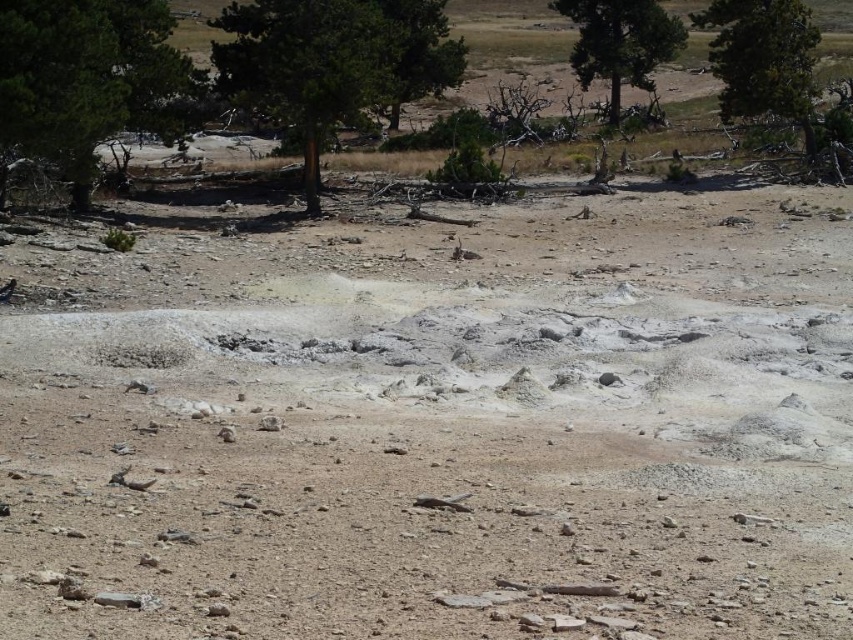
Question: Among these points, which one is nearest to the camera?

Choices:
 (A) (538, 333)
 (B) (798, 36)

Answer: (A)

Question: Can you confirm if dull brown dirt at center is positioned to the left of green rough bark tree at upper center?

Choices:
 (A) no
 (B) yes

Answer: (A)

Question: Observing the image, what is the correct spatial positioning of green rough bark tree at upper left in reference to green textured tree at upper right?

Choices:
 (A) above
 (B) below

Answer: (B)

Question: Among these objects, which one is nearest to the camera?

Choices:
 (A) green rough bark tree at upper center
 (B) dull brown dirt at center

Answer: (B)

Question: Does green textured tree at upper right have a larger size compared to green textured tree at upper center?

Choices:
 (A) no
 (B) yes

Answer: (B)

Question: Among these points, which one is farthest from the camera?

Choices:
 (A) (428, 65)
 (B) (711, 212)
 (C) (781, 99)

Answer: (A)